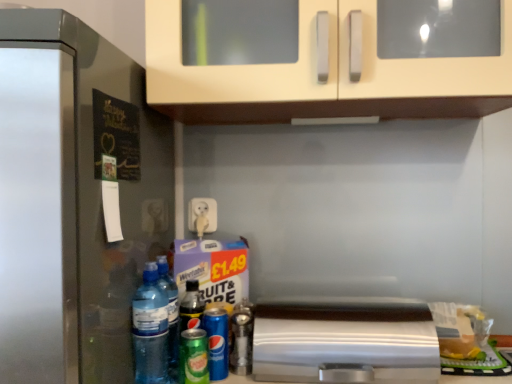
Question: In terms of width, does green matte can at lower center, which is the 2th beer in back-to-front order, look wider or thinner when compared to blue metallic can at lower center, the first beer viewed from the back?

Choices:
 (A) wide
 (B) thin

Answer: (A)

Question: Considering the positions of green matte can at lower center, positioned as the 1th beer in front-to-back order, and blue metallic can at lower center, the second beer from the front, in the image, is green matte can at lower center, positioned as the 1th beer in front-to-back order, taller or shorter than blue metallic can at lower center, the second beer from the front,?

Choices:
 (A) short
 (B) tall

Answer: (A)

Question: Estimate the real-world distances between objects in this image. Which object is farther from the green matte can at lower center, positioned as the 1th beer in front-to-back order?

Choices:
 (A) satin silver toaster at lower center
 (B) blue metallic can at lower center, the second beer from the front
 (C) metallic silver spray can at center, which appears as the first bottle when viewed from the back
 (D) transparent plastic bottle at lower left, which appears as the second bottle when viewed from the front
 (E) translucent plastic water bottle at lower left, marked as the first bottle in a left-to-right arrangement

Answer: (A)

Question: Estimate the real-world distances between objects in this image. Which object is farther from the blue metallic can at lower center, the second beer from the front?

Choices:
 (A) transparent plastic bottle at lower left, positioned as the 2th bottle in right-to-left order
 (B) green matte can at lower center, which is the 2th beer in back-to-front order
 (C) translucent plastic water bottle at lower left, which ranks as the 3th bottle in right-to-left order
 (D) satin silver refrigerator at left
 (E) metallic silver spray can at center, arranged as the 1th bottle when viewed from the right

Answer: (D)